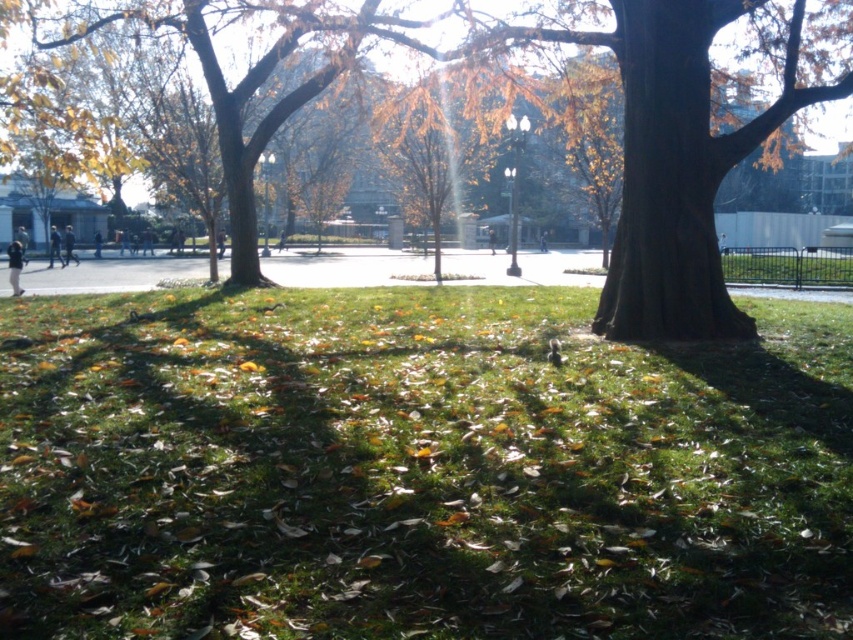
Is black leather jacket at left positioned behind dark blue jeans at left?

No, it is in front of dark blue jeans at left.

How far apart are black leather jacket at left and dark blue jeans at left?

black leather jacket at left and dark blue jeans at left are 33.44 inches apart from each other.

Does point (51, 256) lie behind point (65, 244)?

Yes, it is.

Image resolution: width=853 pixels, height=640 pixels. What are the coordinates of `black leather jacket at left` in the screenshot? It's located at (54, 246).

In the scene shown: Measure the distance between dark blue jeans at left and dark gray fabric at center.

A distance of 43.08 meters exists between dark blue jeans at left and dark gray fabric at center.

Does dark blue jeans at left have a smaller size compared to dark gray fabric at center?

No, dark blue jeans at left is not smaller than dark gray fabric at center.

Who is more forward, (78, 259) or (544, 236)?

Point (78, 259)

Where is `dark blue jeans at left`? The height and width of the screenshot is (640, 853). dark blue jeans at left is located at coordinates (68, 246).

Does dark blue jeans at center have a smaller size compared to black fabric person at center?

No.

Does dark blue jeans at center appear on the right side of black fabric person at center?

Incorrect, dark blue jeans at center is not on the right side of black fabric person at center.

At what (x,y) coordinates should I click in order to perform the action: click on dark blue jeans at center. Please return your answer as a coordinate pair (x, y). Looking at the image, I should click on coord(219,243).

Find the location of `dark blue jeans at center`. dark blue jeans at center is located at coordinates (219, 243).